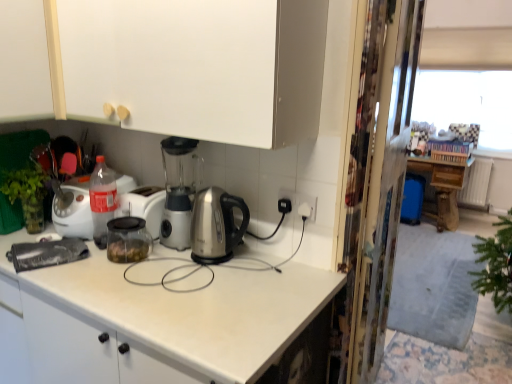
Question: Considering the relative sizes of transparent plastic screen door at right and white matte cabinet at upper left, arranged as the first cabinetry when viewed from the left, in the image provided, is transparent plastic screen door at right thinner than white matte cabinet at upper left, arranged as the first cabinetry when viewed from the left,?

Choices:
 (A) no
 (B) yes

Answer: (B)

Question: Is transparent plastic screen door at right to the left of white matte cabinet at upper left, arranged as the first cabinetry when viewed from the left, from the viewer's perspective?

Choices:
 (A) yes
 (B) no

Answer: (B)

Question: From the image's perspective, is transparent plastic screen door at right over white matte cabinet at upper left, arranged as the 2th cabinetry when viewed from the right?

Choices:
 (A) yes
 (B) no

Answer: (B)

Question: From a real-world perspective, is transparent plastic screen door at right on top of white matte cabinet at upper left, arranged as the 2th cabinetry when viewed from the right?

Choices:
 (A) yes
 (B) no

Answer: (B)

Question: Is transparent plastic screen door at right to the right of white matte cabinet at upper left, arranged as the 2th cabinetry when viewed from the right, from the viewer's perspective?

Choices:
 (A) no
 (B) yes

Answer: (B)

Question: Would you say white matte cabinet at upper left, arranged as the 2th cabinetry when viewed from the right, is to the left or to the right of clear glass jar at center in the picture?

Choices:
 (A) right
 (B) left

Answer: (B)

Question: In terms of width, does white matte cabinet at upper left, arranged as the first cabinetry when viewed from the left, look wider or thinner when compared to clear glass jar at center?

Choices:
 (A) wide
 (B) thin

Answer: (A)

Question: From a real-world perspective, is white matte cabinet at upper left, arranged as the 2th cabinetry when viewed from the right, physically located above or below clear glass jar at center?

Choices:
 (A) below
 (B) above

Answer: (B)

Question: Is white matte cabinet at upper left, arranged as the first cabinetry when viewed from the left, taller or shorter than clear glass jar at center?

Choices:
 (A) tall
 (B) short

Answer: (A)

Question: From their relative heights in the image, would you say white matte cabinet at upper left, arranged as the 2th cabinetry when viewed from the right, is taller or shorter than transparent plastic screen door at right?

Choices:
 (A) short
 (B) tall

Answer: (A)

Question: Choose the correct answer: Is white matte cabinet at upper left, arranged as the first cabinetry when viewed from the left, inside transparent plastic screen door at right or outside it?

Choices:
 (A) inside
 (B) outside

Answer: (B)

Question: In the image, is white matte cabinet at upper left, arranged as the 2th cabinetry when viewed from the right, positioned in front of or behind transparent plastic screen door at right?

Choices:
 (A) behind
 (B) front

Answer: (B)

Question: Looking at their shapes, would you say white matte cabinet at upper left, arranged as the 2th cabinetry when viewed from the right, is wider or thinner than transparent plastic screen door at right?

Choices:
 (A) wide
 (B) thin

Answer: (A)

Question: Relative to white matte cabinet at upper center, arranged as the first cabinetry when viewed from the right, is clear glass jar at center in front or behind?

Choices:
 (A) behind
 (B) front

Answer: (A)

Question: Is clear glass jar at center wider or thinner than white matte cabinet at upper center, arranged as the first cabinetry when viewed from the right?

Choices:
 (A) wide
 (B) thin

Answer: (B)